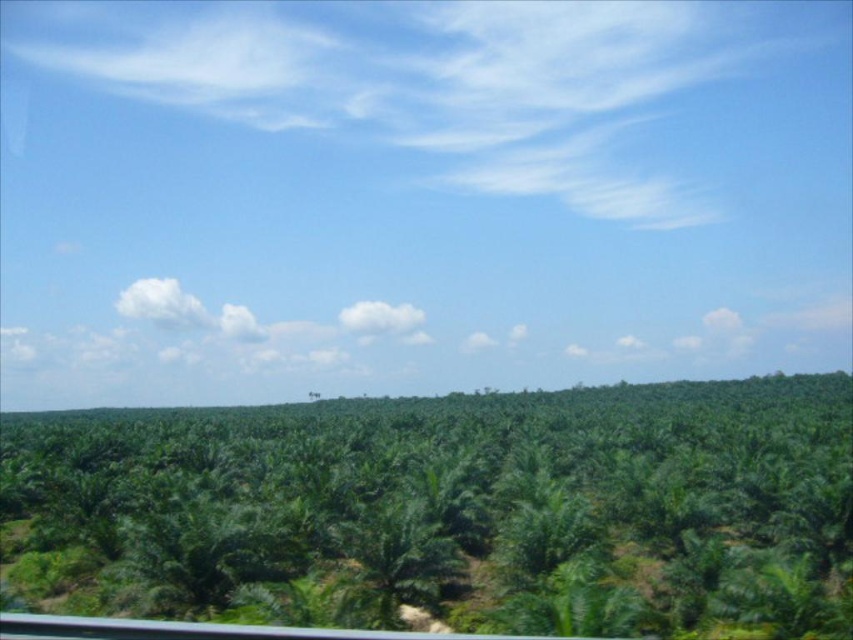
Is green leafy jungle at center above green leafy palm tree at center?

No, green leafy jungle at center is not above green leafy palm tree at center.

This screenshot has height=640, width=853. I want to click on green leafy jungle at center, so click(x=447, y=509).